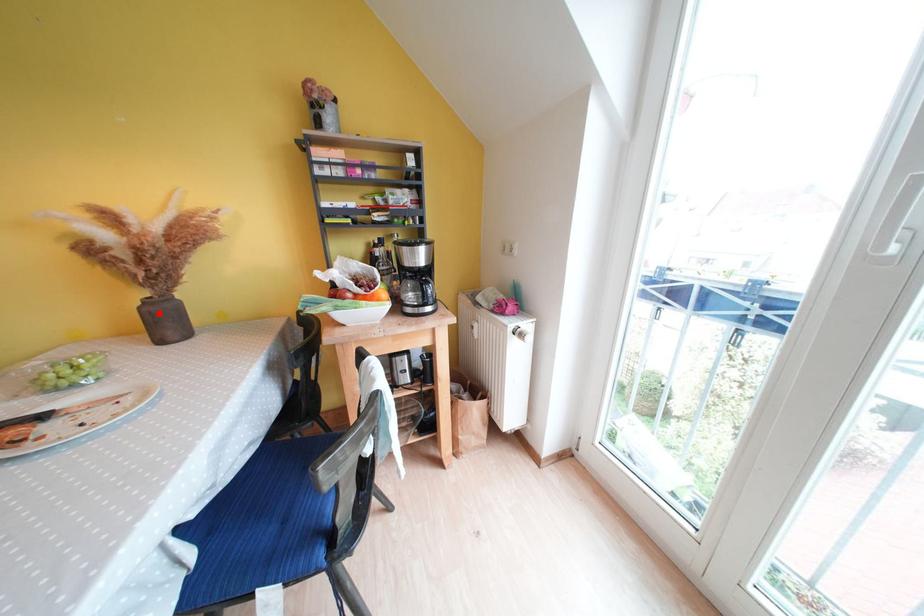
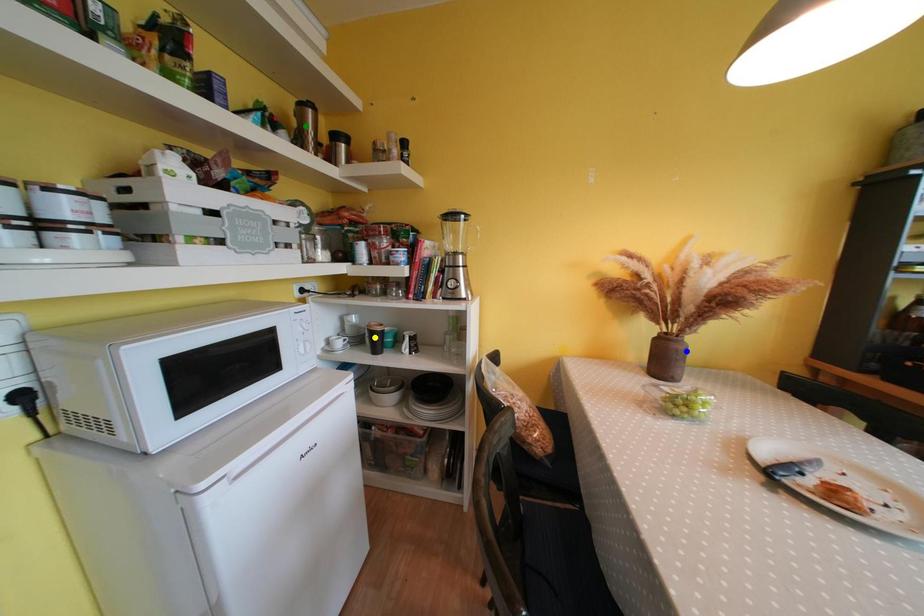
Question: I am providing you with two images of the same scene from different viewpoints. A red point is marked on the first image. You are given multiple points on the second image. Which mark in image 2 goes with the point in image 1?

Choices:
 (A) blue point
 (B) yellow point
 (C) green point

Answer: (A)